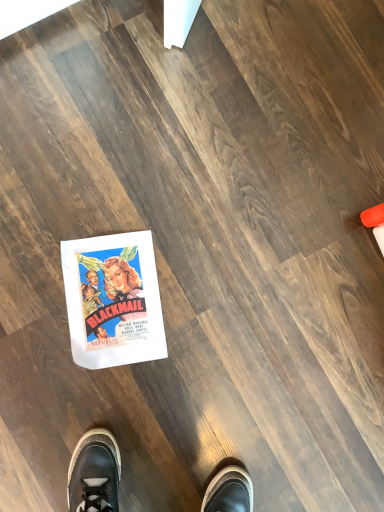
At what (x,y) coordinates should I click in order to perform the action: click on vacant space behind white paper at center. Please return your answer as a coordinate pair (x, y). Looking at the image, I should click on (189, 227).